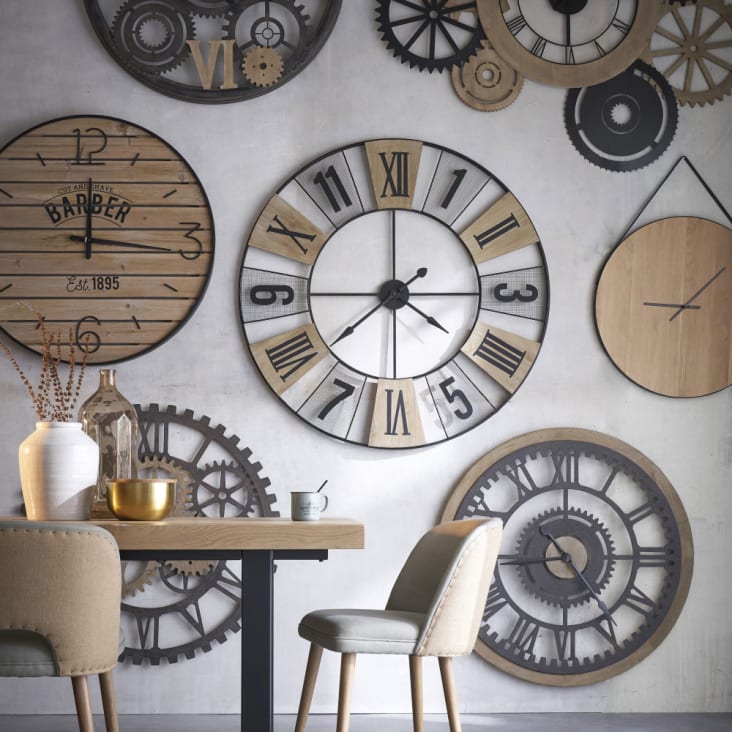
Where is `wall clocks`? Image resolution: width=732 pixels, height=732 pixels. wall clocks is located at coordinates (552, 40), (239, 44), (100, 220), (411, 283), (646, 285), (596, 564), (192, 481).